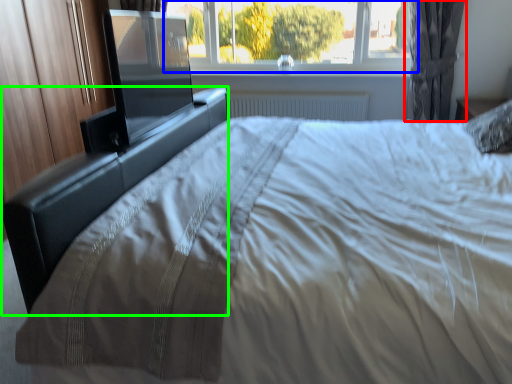
Question: Which is nearer to the curtain (highlighted by a red box)? window (highlighted by a blue box) or bed frame (highlighted by a green box).

Choices:
 (A) window
 (B) bed frame

Answer: (A)